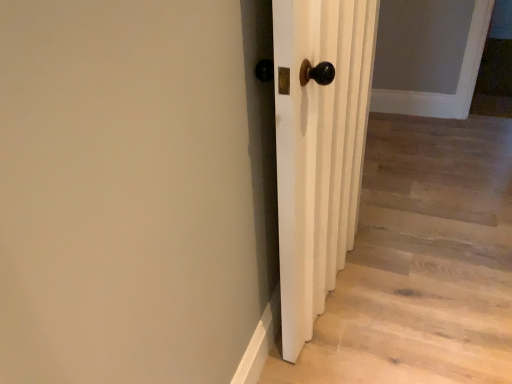
I want to click on free space in front of white wooden door at center, so click(x=365, y=348).